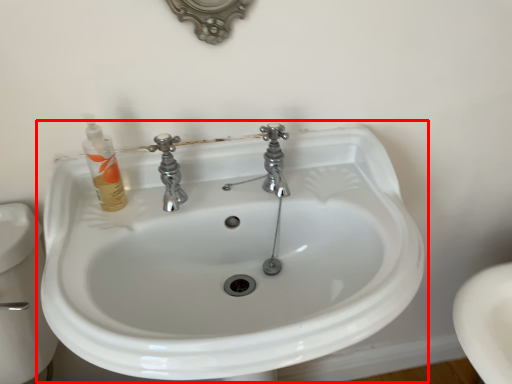
Question: Observing the image, what is the correct spatial positioning of sink (annotated by the red box) in reference to toiletry?

Choices:
 (A) left
 (B) right

Answer: (B)